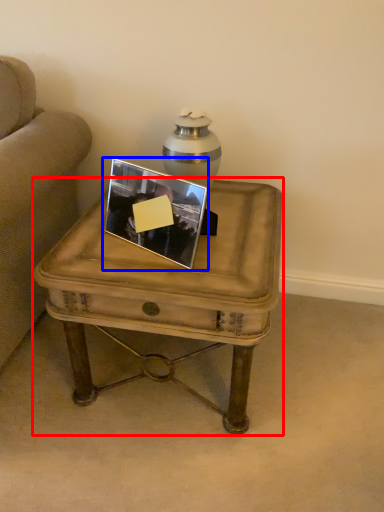
Question: Which of the following is the closest to the observer, coffee table (highlighted by a red box) or picture frame (highlighted by a blue box)?

Choices:
 (A) coffee table
 (B) picture frame

Answer: (A)